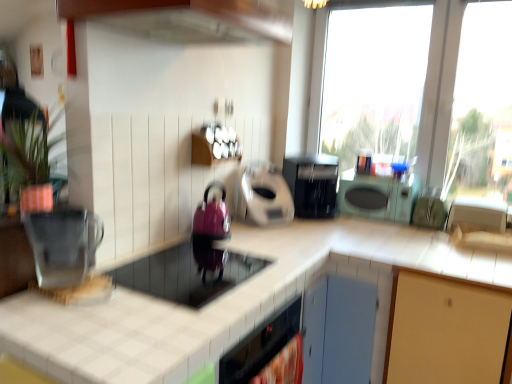
Where is `free space below metallic silver kettle at left, marked as the 5th appliance in a right-to-left arrangement (from a real-world perspective)`? The width and height of the screenshot is (512, 384). free space below metallic silver kettle at left, marked as the 5th appliance in a right-to-left arrangement (from a real-world perspective) is located at coordinates (71, 283).